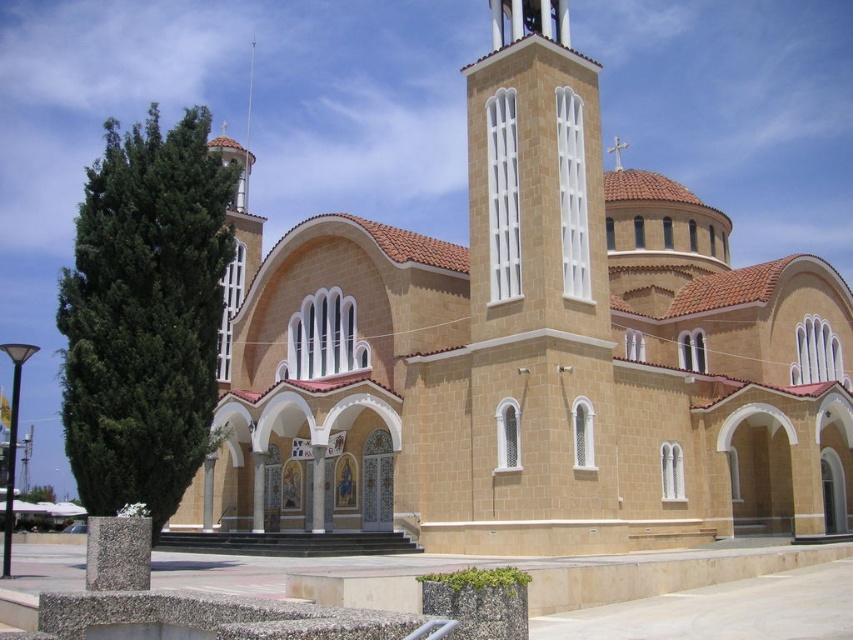
Question: Can you confirm if beige stone church at center is positioned to the right of smooth silver spire at upper center?

Choices:
 (A) no
 (B) yes

Answer: (B)

Question: Can you confirm if beige stone church at center is smaller than smooth silver spire at upper center?

Choices:
 (A) yes
 (B) no

Answer: (B)

Question: Which object is farther from the camera taking this photo?

Choices:
 (A) smooth silver spire at upper center
 (B) beige stone church at center

Answer: (A)

Question: Observing the image, what is the correct spatial positioning of beige stone church at center in reference to smooth silver spire at upper center?

Choices:
 (A) left
 (B) right

Answer: (B)

Question: Among these points, which one is farthest from the camera?

Choices:
 (A) (496, 456)
 (B) (254, 45)

Answer: (B)